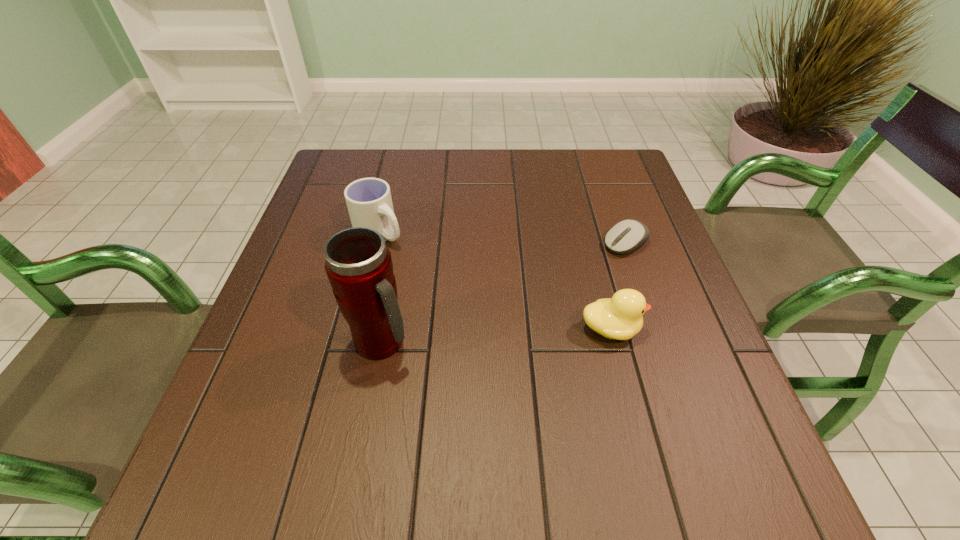
Locate an element on the screen. The width and height of the screenshot is (960, 540). thermos bottle is located at coordinates (358, 263).

Where is `the third tallest object`? This screenshot has height=540, width=960. the third tallest object is located at coordinates (621, 317).

Where is `the second tallest object`? The height and width of the screenshot is (540, 960). the second tallest object is located at coordinates (369, 202).

The image size is (960, 540). What are the coordinates of `computer equipment` in the screenshot? It's located at (627, 235).

Where is `blank space located 0.230m on the side with the handle of the tallest object`? blank space located 0.230m on the side with the handle of the tallest object is located at coordinates (530, 342).

You are a GUI agent. You are given a task and a screenshot of the screen. Output one action in this format:
    pyautogui.click(x=<x>, y=<y>)
    Task: Click on the vacant space located 0.060m on the beak of the third tallest object
    The width and height of the screenshot is (960, 540).
    Given the screenshot: What is the action you would take?
    pyautogui.click(x=672, y=329)

Where is `vacant position located with the handle on the side of the cup`? vacant position located with the handle on the side of the cup is located at coordinates (494, 327).

Locate an element on the screen. This screenshot has width=960, height=540. vacant region located 0.130m with the handle on the side of the cup is located at coordinates (429, 274).

Locate an element on the screen. The height and width of the screenshot is (540, 960). vacant region located with the handle on the side of the cup is located at coordinates (491, 325).

Identify the location of free space located 0.060m on the wheel side of the shortest object. This screenshot has height=540, width=960. (592, 262).